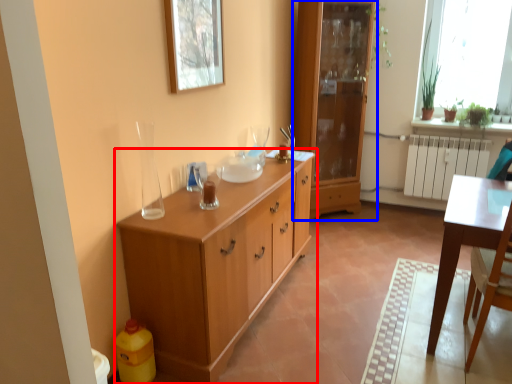
Question: Which object appears closest to the camera in this image, chest of drawers (highlighted by a red box) or cabinetry (highlighted by a blue box)?

Choices:
 (A) chest of drawers
 (B) cabinetry

Answer: (A)